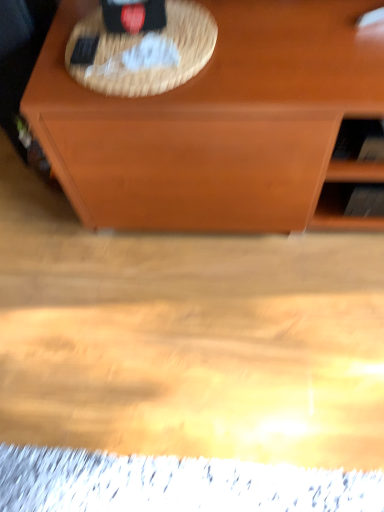
Question: Considering the relative positions of wooden shelf at right and woven straw picnic basket at upper center in the image provided, is wooden shelf at right to the right of woven straw picnic basket at upper center from the viewer's perspective?

Choices:
 (A) no
 (B) yes

Answer: (B)

Question: Does wooden shelf at right have a greater width compared to woven straw picnic basket at upper center?

Choices:
 (A) yes
 (B) no

Answer: (B)

Question: Is wooden shelf at right looking in the opposite direction of woven straw picnic basket at upper center?

Choices:
 (A) no
 (B) yes

Answer: (A)

Question: Does wooden shelf at right have a lesser width compared to woven straw picnic basket at upper center?

Choices:
 (A) yes
 (B) no

Answer: (A)

Question: From the image's perspective, is wooden shelf at right over woven straw picnic basket at upper center?

Choices:
 (A) no
 (B) yes

Answer: (A)

Question: Is the depth of wooden shelf at right greater than that of woven straw picnic basket at upper center?

Choices:
 (A) yes
 (B) no

Answer: (A)

Question: Can you confirm if woven straw picnic basket at upper center is positioned to the left of wooden shelf at right?

Choices:
 (A) yes
 (B) no

Answer: (A)

Question: Is woven straw picnic basket at upper center bigger than wooden shelf at right?

Choices:
 (A) yes
 (B) no

Answer: (B)

Question: Can you confirm if woven straw picnic basket at upper center is thinner than wooden shelf at right?

Choices:
 (A) no
 (B) yes

Answer: (A)

Question: From a real-world perspective, does woven straw picnic basket at upper center sit lower than wooden shelf at right?

Choices:
 (A) no
 (B) yes

Answer: (A)

Question: Does woven straw picnic basket at upper center have a greater height compared to wooden shelf at right?

Choices:
 (A) yes
 (B) no

Answer: (B)

Question: Considering the relative sizes of woven straw picnic basket at upper center and wooden shelf at right in the image provided, is woven straw picnic basket at upper center shorter than wooden shelf at right?

Choices:
 (A) no
 (B) yes

Answer: (B)

Question: Is point (173, 76) positioned closer to the camera than point (357, 189)?

Choices:
 (A) closer
 (B) farther

Answer: (A)